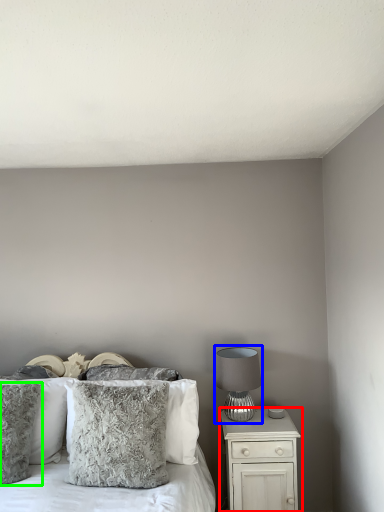
Question: Which object is the farthest from nightstand (highlighted by a red box)? Choose among these: table lamp (highlighted by a blue box) or pillow (highlighted by a green box).

Choices:
 (A) table lamp
 (B) pillow

Answer: (B)